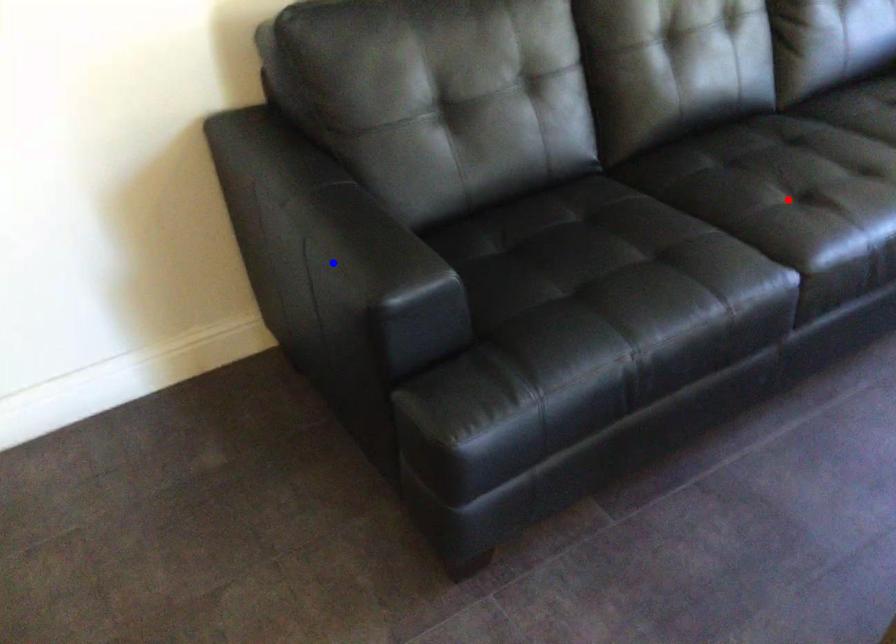
Question: In the image, two points are highlighted. Which point is nearer to the camera? Reply with the corresponding letter.

Choices:
 (A) blue point
 (B) red point

Answer: (B)